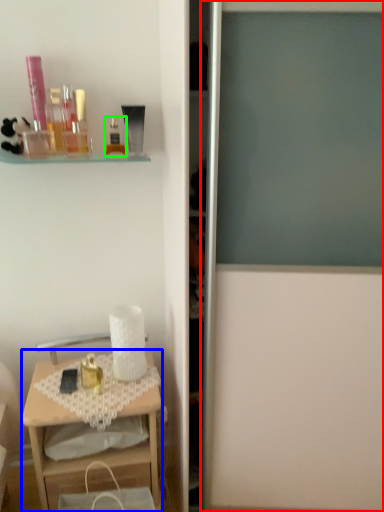
Question: Which object is the closest to the screen door (highlighted by a red box)? Choose among these: desk (highlighted by a blue box) or toiletry (highlighted by a green box).

Choices:
 (A) desk
 (B) toiletry

Answer: (A)